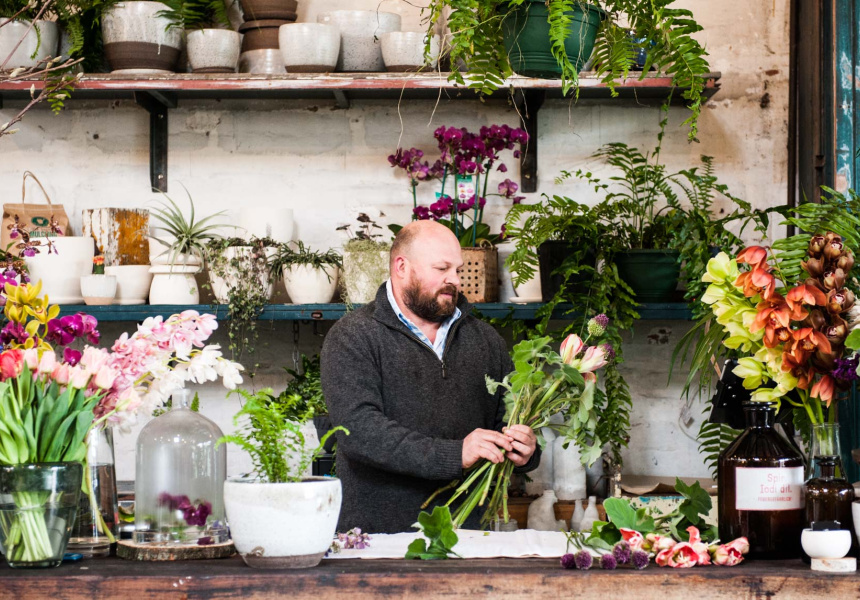
Locate an element on the screen. brown at the bottom of white plant pots is located at coordinates coord(297,561), coord(123,51), coord(216,69), coord(311,66), coord(402,63).